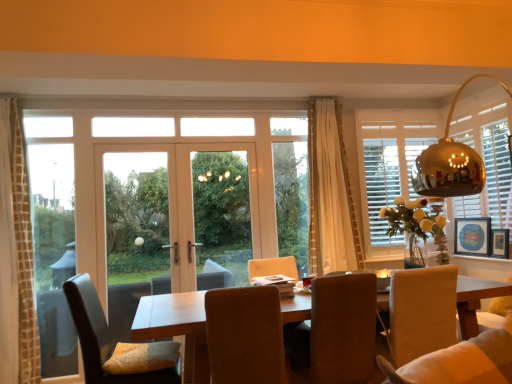
Question: In terms of width, does suede-like brown chair at center, arranged as the 2th chair when viewed from the left, look wider or thinner when compared to brown fabric chair at center, acting as the first chair starting from the right?

Choices:
 (A) thin
 (B) wide

Answer: (B)

Question: From a real-world perspective, is suede-like brown chair at center, positioned as the 2th chair in right-to-left order, positioned above or below brown fabric chair at center, acting as the first chair starting from the right?

Choices:
 (A) above
 (B) below

Answer: (A)

Question: Considering the real-world distances, which object is farthest from the matte white window at right?

Choices:
 (A) white glass door at center
 (B) white sheer curtain at center, which is counted as the second curtain, starting from the left
 (C) wooden picture frame at right, placed as the 2th picture frame when sorted from back to front
 (D) wooden framed artwork at right, positioned as the second picture frame in front-to-back order
 (E) brown fabric chair at center, acting as the first chair starting from the right

Answer: (A)

Question: Considering the real-world distances, which object is farthest from the brown leather chair at lower left, which appears as the third chair when viewed from the right?

Choices:
 (A) white wood screen door at center
 (B) wooden table at center
 (C) clear glass door at center
 (D) white textured curtain at left, the first curtain viewed from the left
 (E) clear glass window at left

Answer: (A)